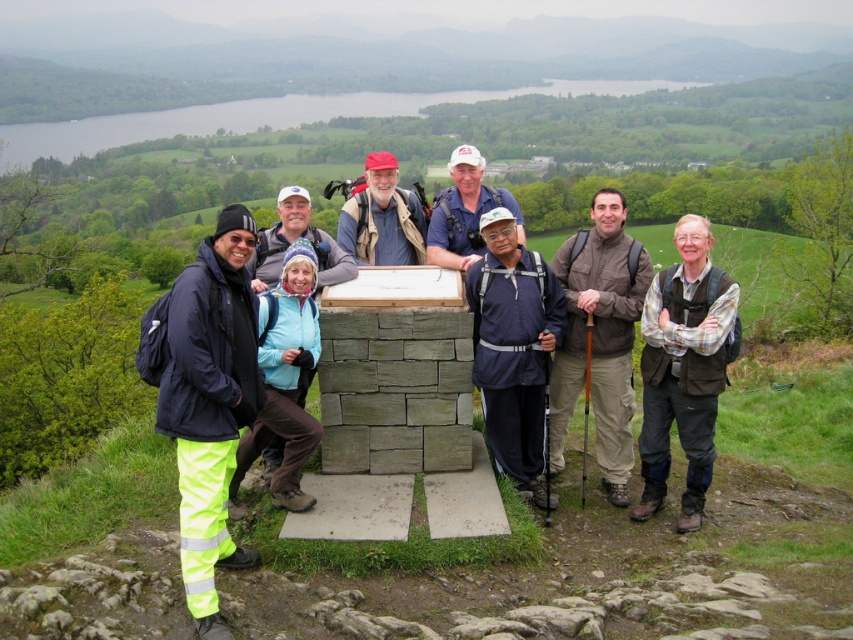
Question: From the image, what is the correct spatial relationship of neon yellow pants at left in relation to blue fleece jacket at center?

Choices:
 (A) below
 (B) above

Answer: (A)

Question: Which point appears farthest from the camera in this image?

Choices:
 (A) (541, 332)
 (B) (386, 168)
 (C) (225, 564)
 (D) (457, 266)

Answer: (B)

Question: Does brown plaid shirt at center appear over brown fabric jacket at center?

Choices:
 (A) yes
 (B) no

Answer: (B)

Question: Where is neon yellow pants at left located in relation to brown plaid shirt at center in the image?

Choices:
 (A) above
 (B) below

Answer: (B)

Question: Which of the following is the farthest from the observer?

Choices:
 (A) navy blue fabric jacket at center
 (B) brown fabric jacket at center
 (C) white fabric cap at center

Answer: (C)

Question: Among these objects, which one is farthest from the camera?

Choices:
 (A) brown fabric jacket at center
 (B) brown plaid shirt at center

Answer: (A)